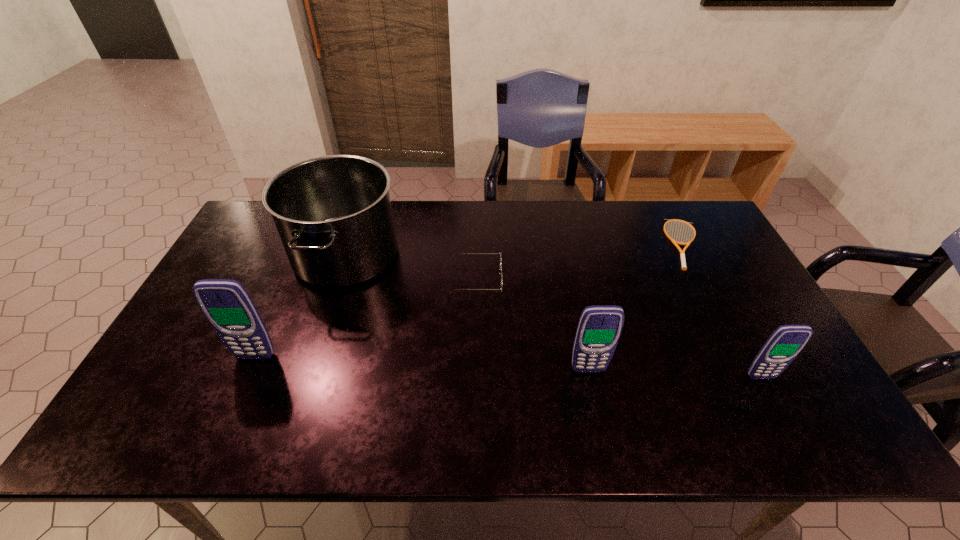
At what (x,y) coordinates should I click in order to perform the action: click on the fourth farthest object. Please return your answer as a coordinate pair (x, y). This screenshot has height=540, width=960. Looking at the image, I should click on (227, 305).

Locate an element on the screen. The image size is (960, 540). the leftmost cellular telephone is located at coordinates (227, 305).

Locate an element on the screen. The width and height of the screenshot is (960, 540). the second cellular telephone from right to left is located at coordinates tap(599, 328).

You are a GUI agent. You are given a task and a screenshot of the screen. Output one action in this format:
    pyautogui.click(x=<x>, y=<y>)
    Task: Click on the second nearest object
    This screenshot has height=540, width=960.
    Given the screenshot: What is the action you would take?
    pyautogui.click(x=599, y=328)

Find the location of a particular element. the fourth tallest object is located at coordinates (785, 343).

Where is `the nearest object`? The height and width of the screenshot is (540, 960). the nearest object is located at coordinates (785, 343).

I want to click on saucepan, so click(333, 213).

Identify the location of the shortest object. This screenshot has width=960, height=540. (682, 253).

The image size is (960, 540). Find the location of `the fifth tallest object`. the fifth tallest object is located at coordinates (500, 252).

Locate an element on the screen. Image resolution: width=960 pixels, height=540 pixels. the third object from left to right is located at coordinates (500, 252).